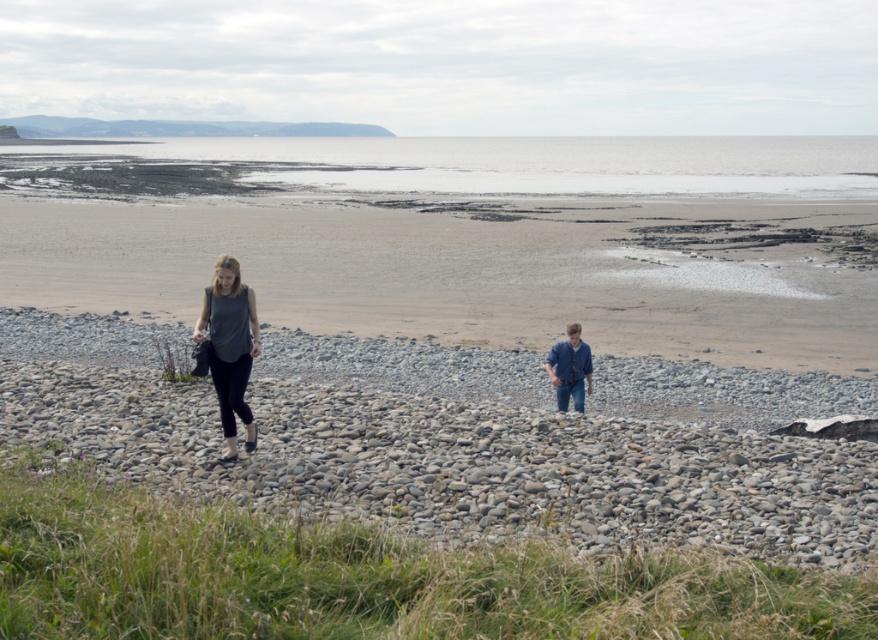
Is gray sand at upper center below blue denim jeans at lower right?

No, gray sand at upper center is not below blue denim jeans at lower right.

Is gray sand at upper center bigger than blue denim jeans at lower right?

Yes, gray sand at upper center is bigger than blue denim jeans at lower right.

Is point (836, 163) positioned in front of point (563, 404)?

No, (836, 163) is behind (563, 404).

You are a GUI agent. You are given a task and a screenshot of the screen. Output one action in this format:
    pyautogui.click(x=<x>, y=<y>)
    Task: Click on the gray sand at upper center
    
    Given the screenshot: What is the action you would take?
    pyautogui.click(x=487, y=163)

Who is shorter, matte gray top at center or blue denim jeans at lower right?

blue denim jeans at lower right

What do you see at coordinates (229, 346) in the screenshot? I see `matte gray top at center` at bounding box center [229, 346].

Who is more forward, (196, 339) or (560, 353)?

Point (196, 339)

Image resolution: width=878 pixels, height=640 pixels. I want to click on matte gray top at center, so (229, 346).

Can you confirm if gray smooth pebbles at center is smaller than blue denim jeans at lower right?

No.

Between gray smooth pebbles at center and blue denim jeans at lower right, which one appears on the right side from the viewer's perspective?

Positioned to the right is blue denim jeans at lower right.

Identify the location of gray smooth pebbles at center. Image resolution: width=878 pixels, height=640 pixels. (459, 438).